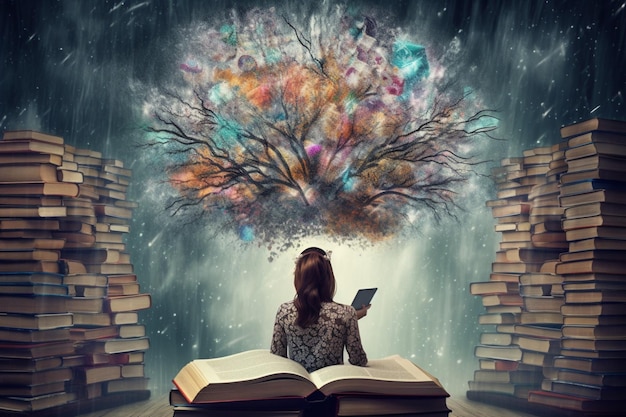
Identify the location of large book in center. This screenshot has width=626, height=417. (310, 382).